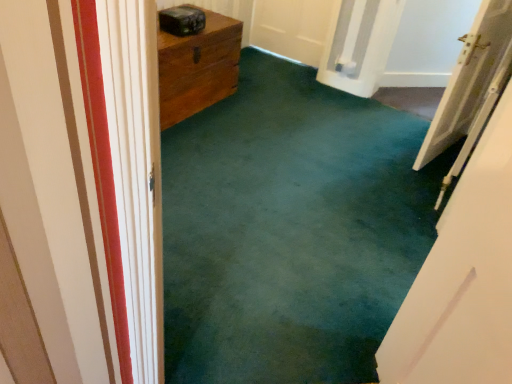
Question: Is point (318, 347) positioned closer to the camera than point (442, 140)?

Choices:
 (A) farther
 (B) closer

Answer: (B)

Question: Is green carpet at center taller or shorter than white wooden door at right?

Choices:
 (A) tall
 (B) short

Answer: (A)

Question: Considering the positions of green carpet at center and white wooden door at right in the image, is green carpet at center wider or thinner than white wooden door at right?

Choices:
 (A) wide
 (B) thin

Answer: (A)

Question: Is point (439, 119) closer or farther from the camera than point (259, 238)?

Choices:
 (A) closer
 (B) farther

Answer: (B)

Question: From a real-world perspective, is white wooden door at right positioned above or below green carpet at center?

Choices:
 (A) below
 (B) above

Answer: (A)

Question: Is white wooden door at right wider or thinner than green carpet at center?

Choices:
 (A) wide
 (B) thin

Answer: (B)

Question: In terms of size, does white wooden door at right appear bigger or smaller than green carpet at center?

Choices:
 (A) small
 (B) big

Answer: (A)